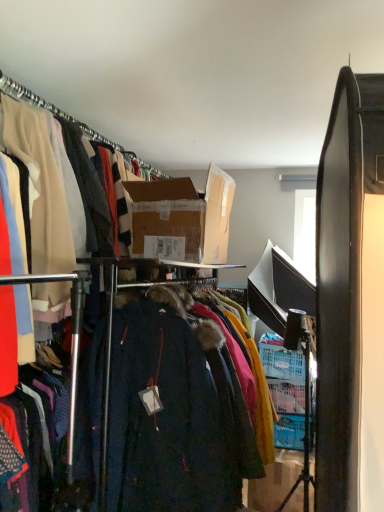
Identify the location of velvet dark coat at center. The width and height of the screenshot is (384, 512). 165,408.

From a real-world perspective, is cardboard box at center, which is the 1th box from back to front, positioned over brown cardboard box at center, placed as the 2th box when sorted from bottom to top, based on gravity?

Incorrect, from a real-world perspective, cardboard box at center, which is the 1th box from back to front, is lower than brown cardboard box at center, placed as the 2th box when sorted from bottom to top.

Is cardboard box at center, acting as the first box starting from the right, smaller than brown cardboard box at center, placed as the 2th box when sorted from back to front?

A: Indeed, cardboard box at center, acting as the first box starting from the right, has a smaller size compared to brown cardboard box at center, placed as the 2th box when sorted from back to front.

Is point (267, 485) behind point (213, 189)?

Yes, point (267, 485) is behind point (213, 189).

Locate an element on the screen. The image size is (384, 512). box located behind the brown cardboard box at center, placed as the 1th box when sorted from top to bottom is located at coordinates (275, 481).

Considering the points (196, 505) and (290, 457), which point is in front, point (196, 505) or point (290, 457)?

Positioned in front is point (196, 505).

From the image's perspective, which is above, velvet dark coat at center or cardboard box at center, arranged as the second box when viewed from the front?

velvet dark coat at center.

Would you consider velvet dark coat at center to be distant from cardboard box at center, arranged as the second box when viewed from the front?

velvet dark coat at center is positioned a significant distance from cardboard box at center, arranged as the second box when viewed from the front.

From the image's perspective, between velvet dark coat at center and matte plastic hanger at upper left, who is located below?

From the image's view, velvet dark coat at center is below.

Can you confirm if velvet dark coat at center is positioned to the right of matte plastic hanger at upper left?

Indeed, velvet dark coat at center is positioned on the right side of matte plastic hanger at upper left.

Which is in front, velvet dark coat at center or matte plastic hanger at upper left?

velvet dark coat at center is more forward.

Is velvet dark coat at center spatially inside matte plastic hanger at upper left, or outside of it?

velvet dark coat at center is located beyond the bounds of matte plastic hanger at upper left.

Which object is more forward, matte plastic hanger at upper left or velvet dark coat at center?

Positioned in front is velvet dark coat at center.

Considering the positions of objects matte plastic hanger at upper left and velvet dark coat at center in the image provided, who is more to the right, matte plastic hanger at upper left or velvet dark coat at center?

Positioned to the right is velvet dark coat at center.

From the image's perspective, is matte plastic hanger at upper left below velvet dark coat at center?

Incorrect, from the image's perspective, matte plastic hanger at upper left is higher than velvet dark coat at center.

Where is `hanger above the velvet dark coat at center (from the image's perspective)`? The height and width of the screenshot is (512, 384). hanger above the velvet dark coat at center (from the image's perspective) is located at coordinates (71, 121).

Is matte plastic hanger at upper left completely or partially inside cardboard box at center, placed as the 2th box when sorted from left to right?

No, matte plastic hanger at upper left is not a part of cardboard box at center, placed as the 2th box when sorted from left to right.

Image resolution: width=384 pixels, height=512 pixels. Find the location of `the 2nd box below when counting from the matte plastic hanger at upper left (from the image's perspective)`. the 2nd box below when counting from the matte plastic hanger at upper left (from the image's perspective) is located at coordinates (275, 481).

Is matte plastic hanger at upper left at the back of cardboard box at center, which ranks as the second box in top-to-bottom order?

No, cardboard box at center, which ranks as the second box in top-to-bottom order, is not facing the opposite direction of matte plastic hanger at upper left.

Between cardboard box at center, which is the 1th box from back to front, and matte plastic hanger at upper left, which one appears on the left side from the viewer's perspective?

matte plastic hanger at upper left.

From the image's perspective, is brown cardboard box at center, placed as the 1th box when sorted from top to bottom, above or below cardboard box at center, which ranks as the 1th box in bottom-to-top order?

brown cardboard box at center, placed as the 1th box when sorted from top to bottom, is situated higher than cardboard box at center, which ranks as the 1th box in bottom-to-top order, in the image.

Is brown cardboard box at center, placed as the 2th box when sorted from back to front, placed right next to cardboard box at center, which is the 1th box from back to front?

brown cardboard box at center, placed as the 2th box when sorted from back to front, is not next to cardboard box at center, which is the 1th box from back to front, and they're not touching.

Can you confirm if brown cardboard box at center, placed as the 2th box when sorted from bottom to top, is wider than cardboard box at center, acting as the first box starting from the right?

In fact, brown cardboard box at center, placed as the 2th box when sorted from bottom to top, might be narrower than cardboard box at center, acting as the first box starting from the right.

Is brown cardboard box at center, which is the first box from left to right, facing towards cardboard box at center, placed as the 2th box when sorted from left to right?

No, brown cardboard box at center, which is the first box from left to right, is not aimed at cardboard box at center, placed as the 2th box when sorted from left to right.

In terms of height, does matte plastic hanger at upper left look taller or shorter compared to cardboard box at center, which is the 1th box from back to front?

In the image, matte plastic hanger at upper left appears to be shorter than cardboard box at center, which is the 1th box from back to front.

Is matte plastic hanger at upper left positioned with its back to cardboard box at center, placed as the 2th box when sorted from left to right?

No, cardboard box at center, placed as the 2th box when sorted from left to right, is not at the back of matte plastic hanger at upper left.

Which of these two, matte plastic hanger at upper left or cardboard box at center, placed as the 2th box when sorted from left to right, is wider?

cardboard box at center, placed as the 2th box when sorted from left to right, is wider.

In the image, is matte plastic hanger at upper left positioned in front of or behind cardboard box at center, acting as the first box starting from the right?

matte plastic hanger at upper left is positioned closer to the viewer than cardboard box at center, acting as the first box starting from the right.

Image resolution: width=384 pixels, height=512 pixels. I want to click on box on the right side of brown cardboard box at center, placed as the 2th box when sorted from bottom to top, so click(275, 481).

Locate an element on the screen. box below the velvet dark coat at center (from a real-world perspective) is located at coordinates (275, 481).

Considering their positions, is matte plastic hanger at upper left positioned further to brown cardboard box at center, the first box viewed from the front, than velvet dark coat at center?

velvet dark coat at center lies further to brown cardboard box at center, the first box viewed from the front, than the other object.

Looking at the image, which one is located further to cardboard box at center, which is the 1th box from back to front, brown cardboard box at center, placed as the 2th box when sorted from back to front, or velvet dark coat at center?

Among the two, brown cardboard box at center, placed as the 2th box when sorted from back to front, is located further to cardboard box at center, which is the 1th box from back to front.

Estimate the real-world distances between objects in this image. Which object is closer to matte plastic hanger at upper left, velvet dark coat at center or brown cardboard box at center, which ranks as the 2th box in right-to-left order?

brown cardboard box at center, which ranks as the 2th box in right-to-left order, lies closer to matte plastic hanger at upper left than the other object.

Which object lies further to the anchor point brown cardboard box at center, placed as the 2th box when sorted from back to front, cardboard box at center, arranged as the second box when viewed from the front, or velvet dark coat at center?

cardboard box at center, arranged as the second box when viewed from the front, is positioned further to the anchor brown cardboard box at center, placed as the 2th box when sorted from back to front.

Considering their positions, is cardboard box at center, placed as the 2th box when sorted from left to right, positioned further to brown cardboard box at center, placed as the 2th box when sorted from bottom to top, than matte plastic hanger at upper left?

Based on the image, cardboard box at center, placed as the 2th box when sorted from left to right, appears to be further to brown cardboard box at center, placed as the 2th box when sorted from bottom to top.

Looking at the image, which one is located closer to matte plastic hanger at upper left, brown cardboard box at center, placed as the 1th box when sorted from top to bottom, or cardboard box at center, arranged as the second box when viewed from the front?

The object closer to matte plastic hanger at upper left is brown cardboard box at center, placed as the 1th box when sorted from top to bottom.

Looking at the image, which one is located further to matte plastic hanger at upper left, velvet dark coat at center or cardboard box at center, placed as the 2th box when sorted from left to right?

cardboard box at center, placed as the 2th box when sorted from left to right, is further to matte plastic hanger at upper left.

Considering their positions, is brown cardboard box at center, which is the first box from left to right, positioned closer to matte plastic hanger at upper left than velvet dark coat at center?

brown cardboard box at center, which is the first box from left to right, lies closer to matte plastic hanger at upper left than the other object.

You are a GUI agent. You are given a task and a screenshot of the screen. Output one action in this format:
    pyautogui.click(x=<x>, y=<y>)
    Task: Click on the box between matte plastic hanger at upper left and velvet dark coat at center from top to bottom
    
    Given the screenshot: What is the action you would take?
    pyautogui.click(x=183, y=216)

Locate an element on the screen. This screenshot has width=384, height=512. closet between matte plastic hanger at upper left and cardboard box at center, acting as the first box starting from the right, in the vertical direction is located at coordinates (165, 408).

Locate an element on the screen. box between matte plastic hanger at upper left and cardboard box at center, acting as the first box starting from the right, in the vertical direction is located at coordinates (183, 216).

Where is `closet that lies between brown cardboard box at center, placed as the 1th box when sorted from top to bottom, and cardboard box at center, placed as the 2th box when sorted from left to right, from top to bottom`? closet that lies between brown cardboard box at center, placed as the 1th box when sorted from top to bottom, and cardboard box at center, placed as the 2th box when sorted from left to right, from top to bottom is located at coordinates (165, 408).